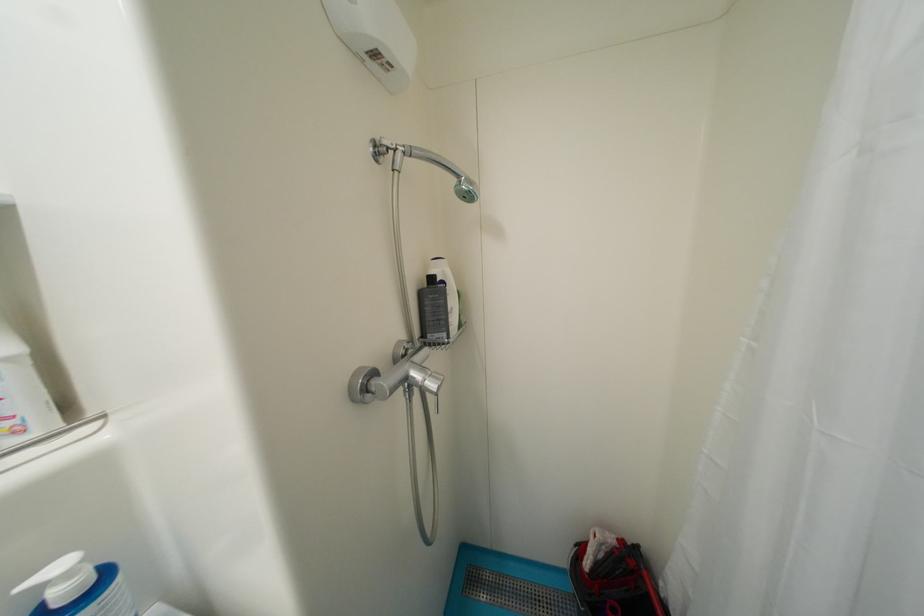
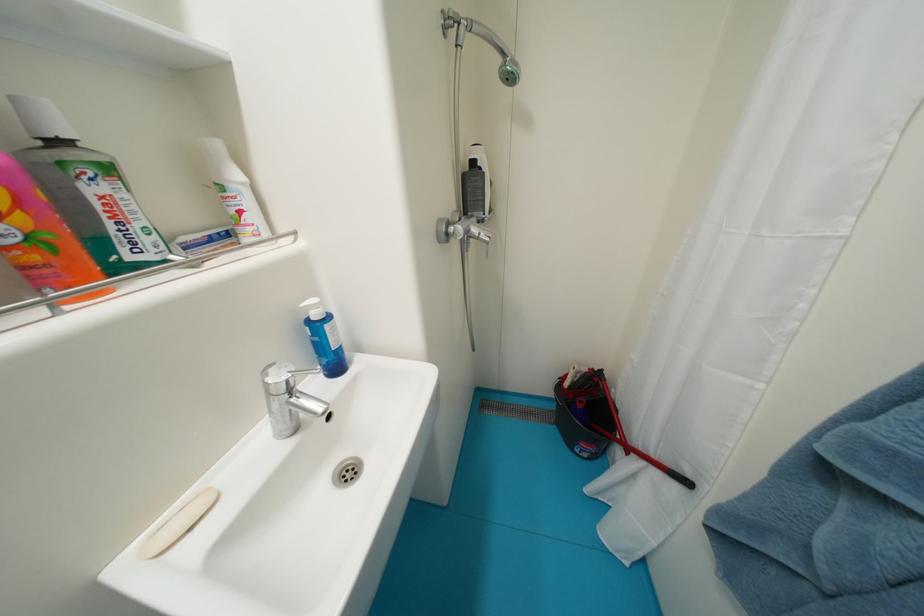
Which direction would the cameraman need to move to produce the second image?

The cameraman moved toward left, backward.